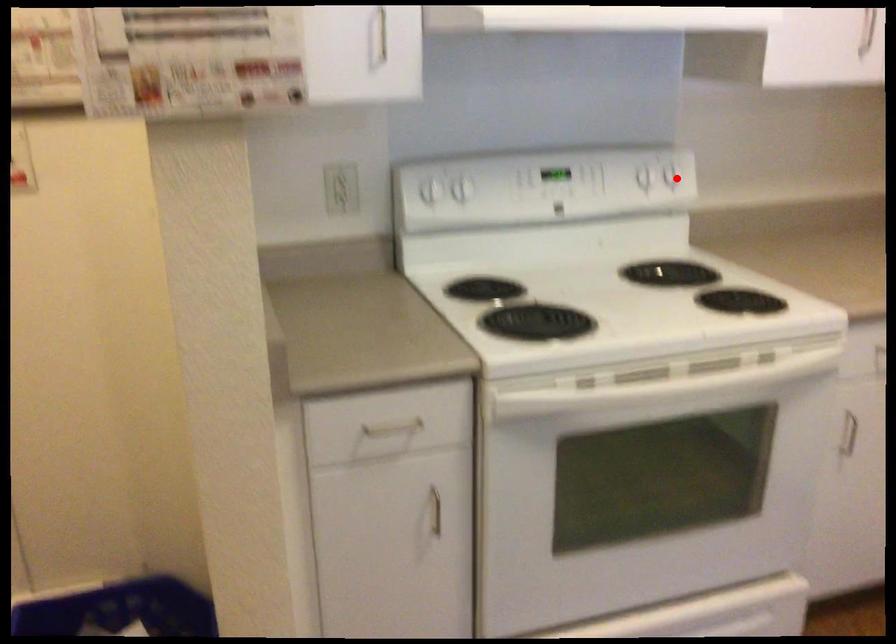
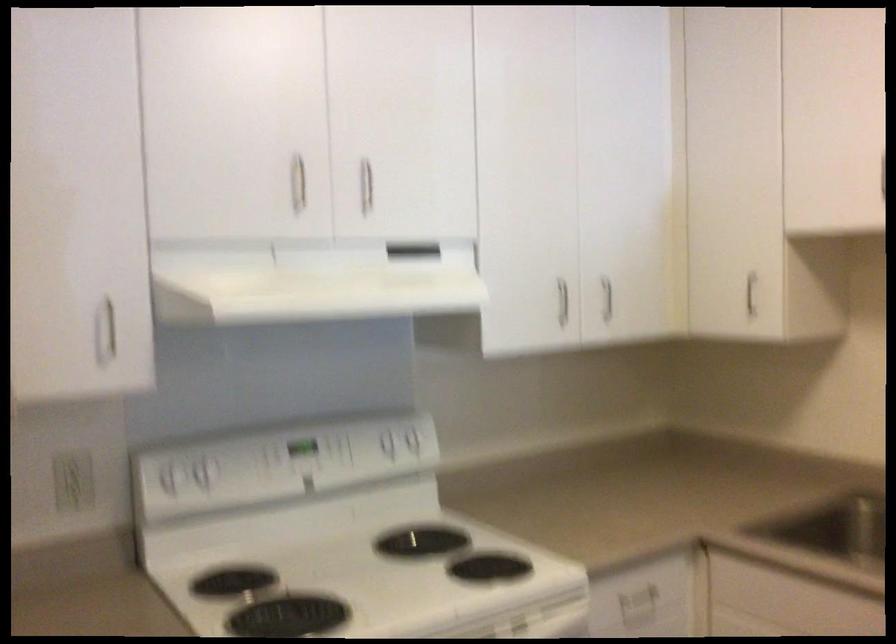
In the second image, find the point that corresponds to the highlighted location in the first image.

(419, 444)